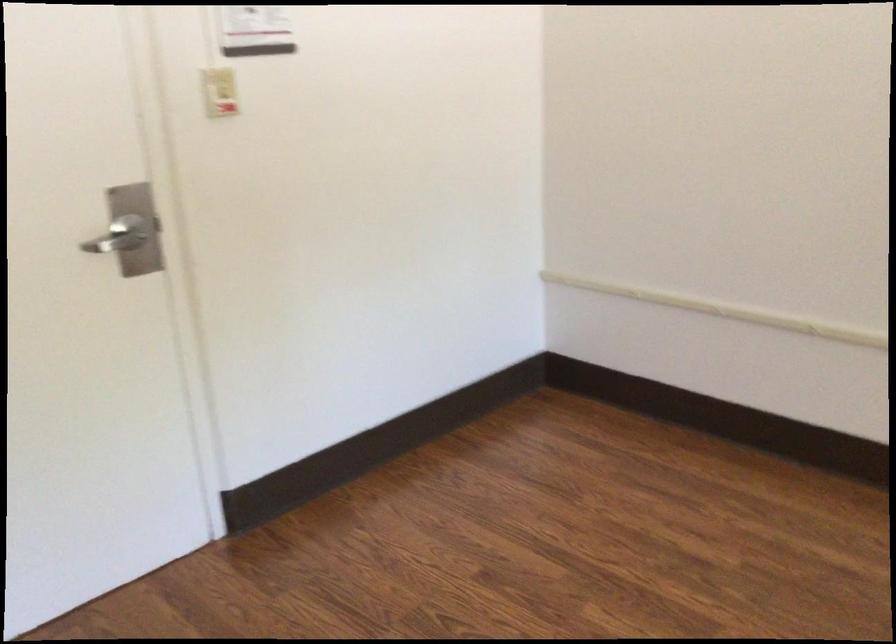
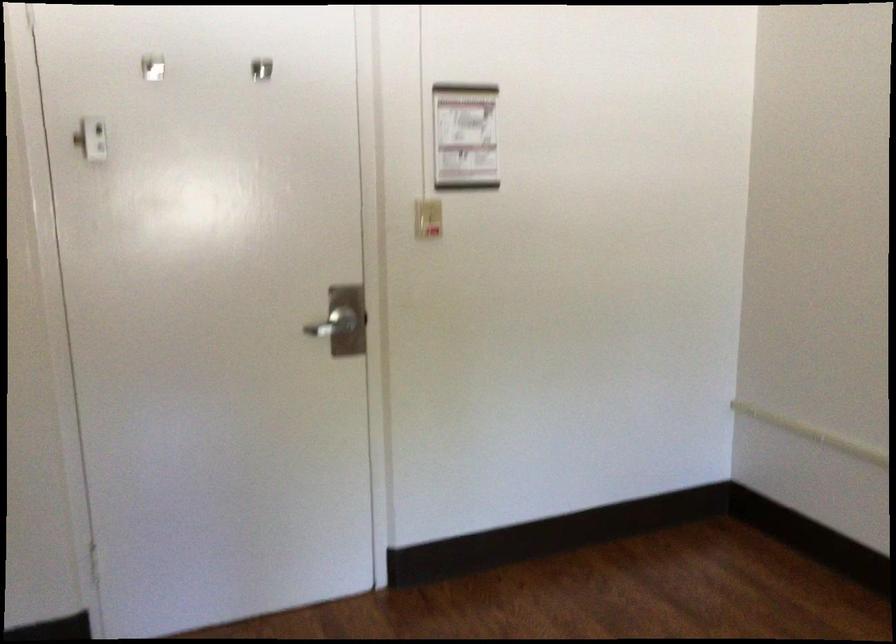
The point at [113,238] is marked in the first image. Where is the corresponding point in the second image?

(330, 323)